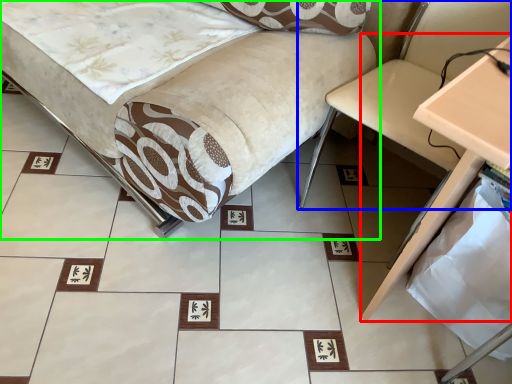
Question: Estimate the real-world distances between objects in this image. Which object is closer to table (highlighted by a red box), swivel chair (highlighted by a blue box) or furniture (highlighted by a green box)?

Choices:
 (A) swivel chair
 (B) furniture

Answer: (A)